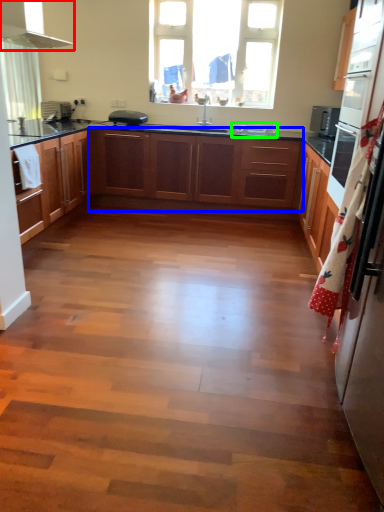
Question: Based on their relative distances, which object is farther from exhaust hood (highlighted by a red box)? Choose from cabinetry (highlighted by a blue box) and sink (highlighted by a green box).

Choices:
 (A) cabinetry
 (B) sink

Answer: (B)